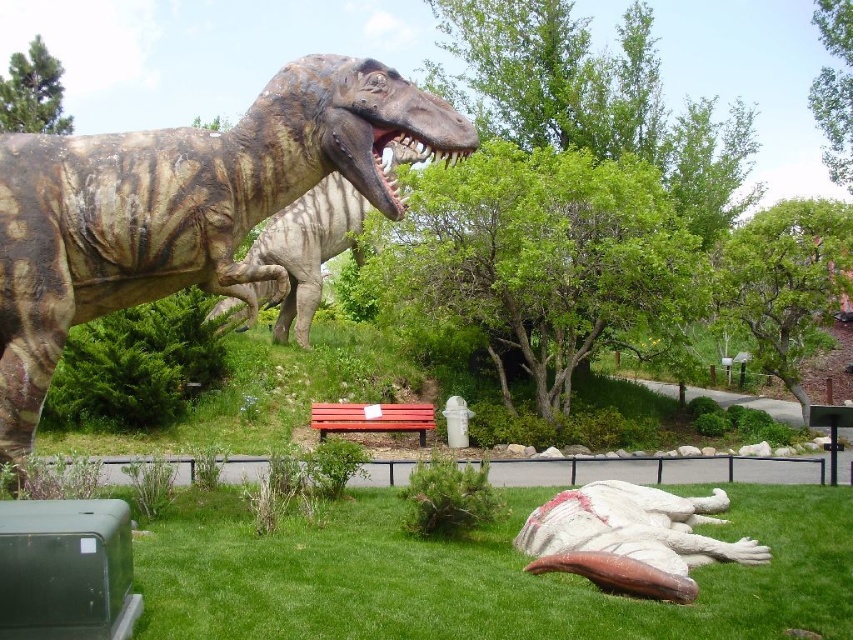
You are a park visitor who wants to take a photo of both the camouflage textured dinosaur at upper left and the white marble dinosaur at lower right. Which dinosaur should you stand closer to in order to capture both in a single frame?

Since the camouflage textured dinosaur at upper left is larger than the white marble dinosaur at lower right, you should stand closer to the white marble dinosaur at lower right to balance their sizes in the photo.

You are standing in the park and want to place a new informational sign between the two points, point (x=283, y=168) and point (x=648, y=544). Which point is closer to you so that the sign can be placed in the middle?

Point (x=283, y=168) is closer to you than point (x=648, y=544), so the sign should be placed between them at the midpoint.

Looking at this image, you are a park visitor standing in the middle of the dinosaur exhibit. You see the camouflage textured dinosaur at upper left and the white marble dinosaur at lower right. Which dinosaur is closer to you?

The camouflage textured dinosaur at upper left is closer to you since the white marble dinosaur at lower right is behind it.